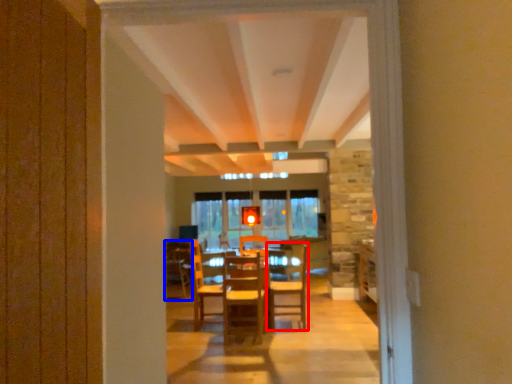
Question: Among these objects, which one is nearest to the camera, chair (highlighted by a red box) or armchair (highlighted by a blue box)?

Choices:
 (A) chair
 (B) armchair

Answer: (A)